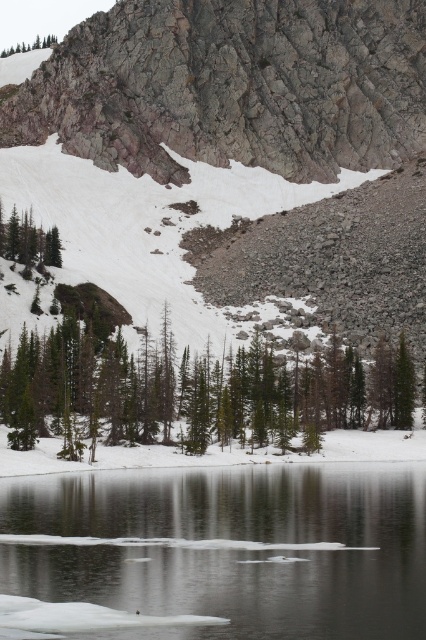
Does clear ice at lower center have a smaller size compared to green matte tree at lower left?

No, clear ice at lower center is not smaller than green matte tree at lower left.

Does clear ice at lower center have a greater height compared to green matte tree at lower left?

In fact, clear ice at lower center may be shorter than green matte tree at lower left.

Is point (48, 536) positioned behind point (51, 241)?

That is False.

This screenshot has width=426, height=640. Identify the location of clear ice at lower center. (227, 547).

Is point (411, 422) behind point (6, 52)?

No, (411, 422) is closer to viewer.

Does green matte tree at center have a smaller size compared to green matte tree at upper left?

Yes, green matte tree at center is smaller than green matte tree at upper left.

Is point (278, 408) less distant than point (42, 38)?

Yes, it is in front of point (42, 38).

At what (x,y) coordinates should I click in order to perform the action: click on green matte tree at center. Please return your answer as a coordinate pair (x, y). The width and height of the screenshot is (426, 640). Looking at the image, I should click on (195, 392).

Between point (350, 536) and point (34, 49), which one is positioned in front?

Point (350, 536)

Where is `clear ice at lower center`? This screenshot has width=426, height=640. clear ice at lower center is located at coordinates (227, 547).